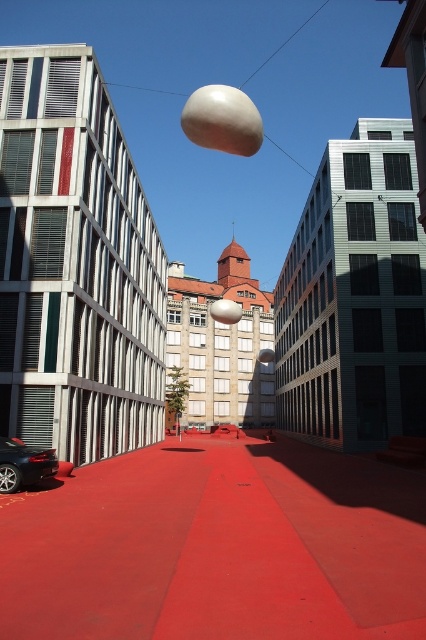
In the scene shown: Between red rubber plaza at center and shiny black car at lower left, which one is positioned lower?

red rubber plaza at center is lower down.

Can you confirm if red rubber plaza at center is positioned above shiny black car at lower left?

Incorrect, red rubber plaza at center is not positioned above shiny black car at lower left.

This screenshot has height=640, width=426. I want to click on red rubber plaza at center, so click(x=218, y=547).